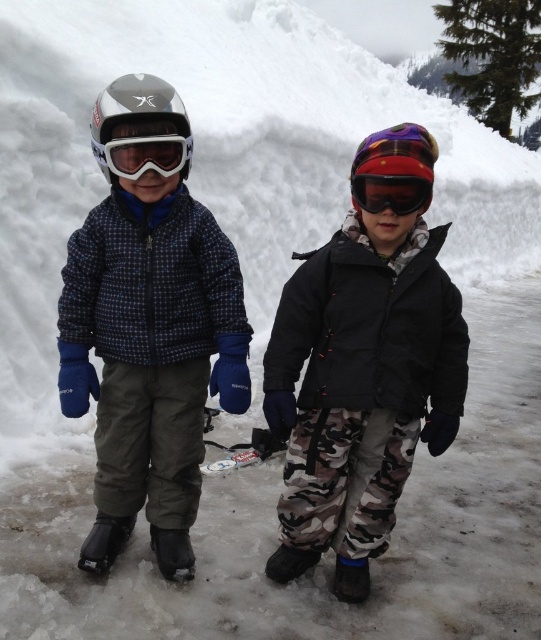
Between point (282, 403) and point (359, 189), which one is positioned behind?

The point (282, 403) is more distant.

Between point (457, 323) and point (408, 148), which one is positioned in front?

Point (408, 148)

Locate an element on the screen. This screenshot has width=541, height=640. camo fabric snow pants at center is located at coordinates (360, 387).

Between matte blue jacket at left and red matte ski goggles at center, which one appears on the right side from the viewer's perspective?

From the viewer's perspective, red matte ski goggles at center appears more on the right side.

Describe the element at coordinates (149, 356) in the screenshot. I see `matte blue jacket at left` at that location.

You are a GUI agent. You are given a task and a screenshot of the screen. Output one action in this format:
    pyautogui.click(x=<x>, y=<y>)
    Task: Click on the matte blue jacket at left
    The width and height of the screenshot is (541, 640).
    Given the screenshot: What is the action you would take?
    pyautogui.click(x=149, y=356)

Is camo fabric snow pants at center smaller than matte black helmet at left?

Incorrect, camo fabric snow pants at center is not smaller in size than matte black helmet at left.

In the scene shown: Who is more forward, [362,442] or [107,106]?

Positioned in front is point [107,106].

Identify the location of camo fabric snow pants at center. The image size is (541, 640). (360, 387).